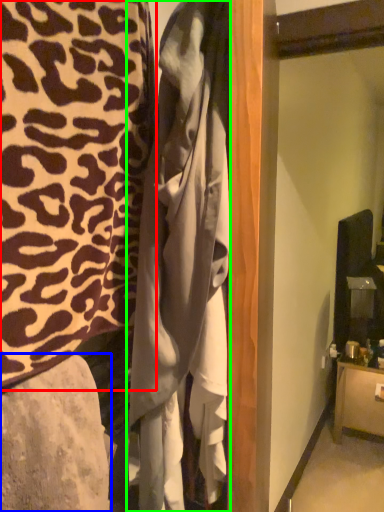
Question: Estimate the real-world distances between objects in this image. Which object is farther from furniture (highlighted by a red box), furniture (highlighted by a blue box) or clothing (highlighted by a green box)?

Choices:
 (A) furniture
 (B) clothing

Answer: (A)